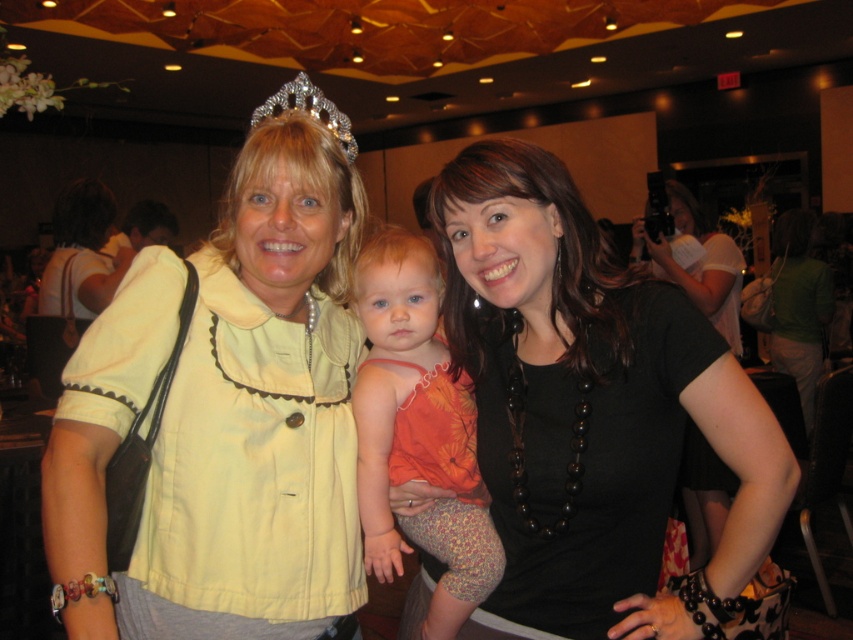
Does black matte necklace at center have a lesser width compared to sparkling silver tiara at upper center?

No, black matte necklace at center is not thinner than sparkling silver tiara at upper center.

Can you confirm if black matte necklace at center is shorter than sparkling silver tiara at upper center?

No, black matte necklace at center is not shorter than sparkling silver tiara at upper center.

What do you see at coordinates (590, 406) in the screenshot? Image resolution: width=853 pixels, height=640 pixels. I see `black matte necklace at center` at bounding box center [590, 406].

The width and height of the screenshot is (853, 640). In order to click on black matte necklace at center in this screenshot , I will do `click(590, 406)`.

Who is higher up, yellow fabric at center or black matte necklace at center?

yellow fabric at center is above.

Is yellow fabric at center smaller than black matte necklace at center?

No, yellow fabric at center is not smaller than black matte necklace at center.

Locate an element on the screen. Image resolution: width=853 pixels, height=640 pixels. yellow fabric at center is located at coordinates (227, 410).

Is point (318, 198) less distant than point (289, 84)?

Yes, it is.

Between yellow fabric at center and sparkling silver tiara at upper center, which one appears on the right side from the viewer's perspective?

sparkling silver tiara at upper center is more to the right.

Does point (245, 196) lie behind point (293, 100)?

No, (245, 196) is closer to viewer.

Where is `yellow fabric at center`? yellow fabric at center is located at coordinates (227, 410).